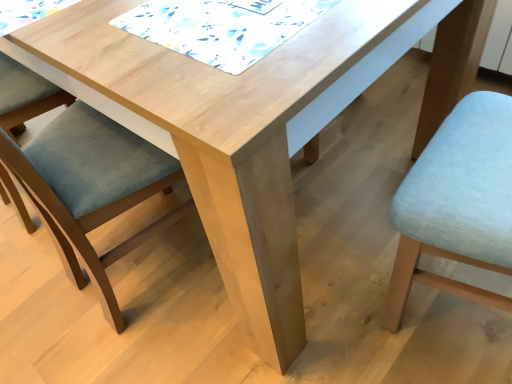
Question: Is white printed fabric at upper center at the left side of matte blue cushion at left, arranged as the second chair when viewed from the right?

Choices:
 (A) no
 (B) yes

Answer: (A)

Question: Is white printed fabric at upper center surrounding matte blue cushion at left, arranged as the first chair when viewed from the left?

Choices:
 (A) yes
 (B) no

Answer: (B)

Question: Is the depth of white printed fabric at upper center less than that of matte blue cushion at left, arranged as the second chair when viewed from the right?

Choices:
 (A) no
 (B) yes

Answer: (A)

Question: Is white printed fabric at upper center to the right of matte blue cushion at left, arranged as the second chair when viewed from the right, from the viewer's perspective?

Choices:
 (A) no
 (B) yes

Answer: (B)

Question: Is white printed fabric at upper center positioned with its back to matte blue cushion at left, arranged as the second chair when viewed from the right?

Choices:
 (A) yes
 (B) no

Answer: (B)

Question: Relative to matte blue cushion at left, arranged as the first chair when viewed from the left, is light blue fabric chair at lower right, positioned as the first chair in right-to-left order, in front or behind?

Choices:
 (A) front
 (B) behind

Answer: (A)

Question: From a real-world perspective, is light blue fabric chair at lower right, positioned as the first chair in right-to-left order, above or below matte blue cushion at left, arranged as the second chair when viewed from the right?

Choices:
 (A) above
 (B) below

Answer: (A)

Question: From the image's perspective, is light blue fabric chair at lower right, positioned as the first chair in right-to-left order, above or below matte blue cushion at left, arranged as the first chair when viewed from the left?

Choices:
 (A) below
 (B) above

Answer: (A)

Question: Visually, is light blue fabric chair at lower right, positioned as the first chair in right-to-left order, positioned to the left or to the right of matte blue cushion at left, arranged as the second chair when viewed from the right?

Choices:
 (A) right
 (B) left

Answer: (A)

Question: From the image's perspective, is matte blue cushion at left, arranged as the first chair when viewed from the left, above or below light blue fabric chair at lower right, positioned as the first chair in right-to-left order?

Choices:
 (A) above
 (B) below

Answer: (A)

Question: Considering the positions of matte blue cushion at left, arranged as the first chair when viewed from the left, and light blue fabric chair at lower right, positioned as the first chair in right-to-left order, in the image, is matte blue cushion at left, arranged as the first chair when viewed from the left, wider or thinner than light blue fabric chair at lower right, positioned as the first chair in right-to-left order,?

Choices:
 (A) thin
 (B) wide

Answer: (B)

Question: From their relative heights in the image, would you say matte blue cushion at left, arranged as the second chair when viewed from the right, is taller or shorter than light blue fabric chair at lower right, positioned as the first chair in right-to-left order?

Choices:
 (A) tall
 (B) short

Answer: (B)

Question: Based on their sizes in the image, would you say matte blue cushion at left, arranged as the second chair when viewed from the right, is bigger or smaller than light blue fabric chair at lower right, positioned as the first chair in right-to-left order?

Choices:
 (A) big
 (B) small

Answer: (A)

Question: Would you say white printed fabric at upper center is inside or outside matte blue cushion at left, arranged as the second chair when viewed from the right?

Choices:
 (A) inside
 (B) outside

Answer: (B)

Question: In the image, is white printed fabric at upper center positioned in front of or behind matte blue cushion at left, arranged as the first chair when viewed from the left?

Choices:
 (A) front
 (B) behind

Answer: (B)